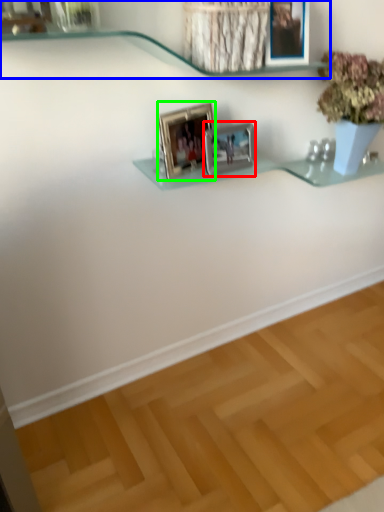
Question: Which object is the farthest from picture frame (highlighted by a red box)? Choose among these: shelf (highlighted by a blue box) or picture frame (highlighted by a green box).

Choices:
 (A) shelf
 (B) picture frame

Answer: (A)